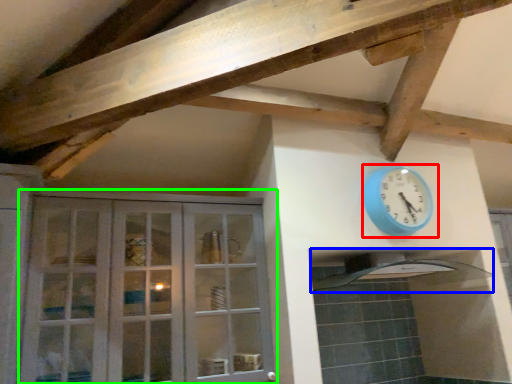
Question: Considering the real-world distances, which object is closest to wall clock (highlighted by a red box)? exhaust hood (highlighted by a blue box) or cabinetry (highlighted by a green box).

Choices:
 (A) exhaust hood
 (B) cabinetry

Answer: (A)